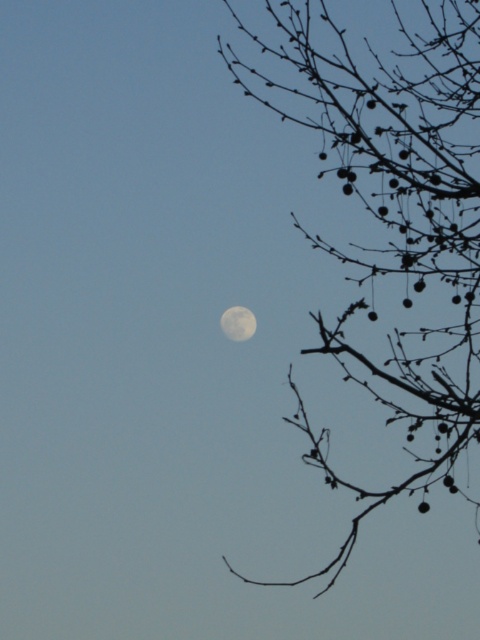
You are an astronomer observing the night sky. You notice the silvery bark branches at right and the white matte moon at upper right. Based on their positions, can you estimate how far apart they appear to be from your viewpoint?

The distance between the silvery bark branches at right and the white matte moon at upper right is 6.50 feet, so they appear to be 6.50 feet apart from your viewpoint.